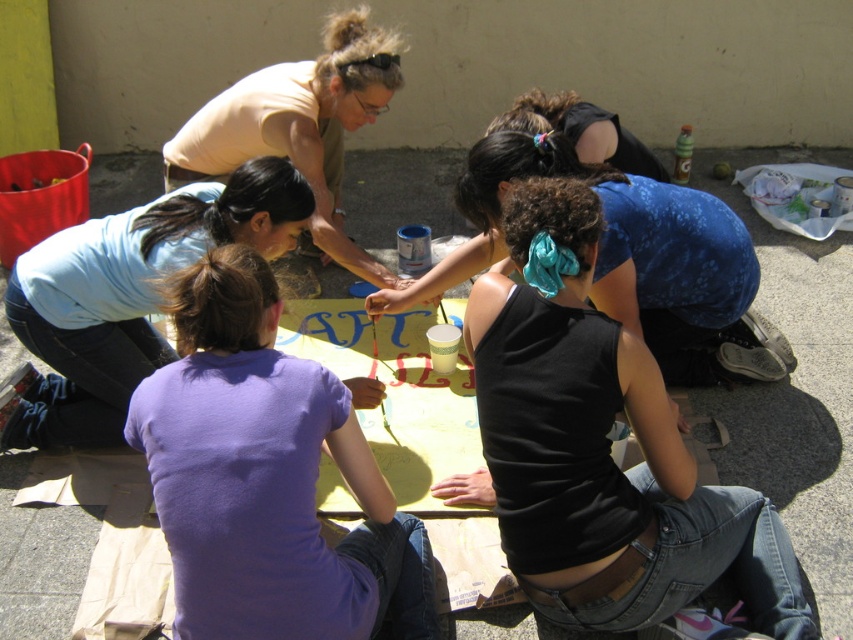
Question: Observing the image, what is the correct spatial positioning of black tank top at center in reference to purple cotton shirt at center?

Choices:
 (A) below
 (B) above

Answer: (B)

Question: Which of the following is the closest to the observer?

Choices:
 (A) blue floral tank top at center
 (B) purple cotton shirt at center

Answer: (B)

Question: Where is black tank top at center located in relation to light blue fabric at upper left in the image?

Choices:
 (A) left
 (B) right

Answer: (B)

Question: Which object is farther from the camera taking this photo?

Choices:
 (A) light blue fabric at upper left
 (B) purple cotton shirt at center

Answer: (A)

Question: Which point appears farthest from the camera in this image?

Choices:
 (A) (497, 276)
 (B) (100, 237)
 (C) (299, 77)
 (D) (550, 144)

Answer: (C)

Question: Is light blue fabric at upper left above light yellow t-shirt at upper left?

Choices:
 (A) yes
 (B) no

Answer: (B)